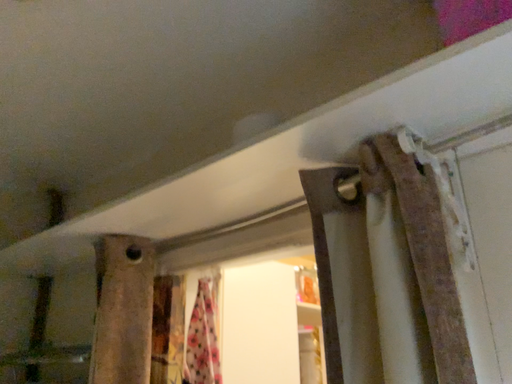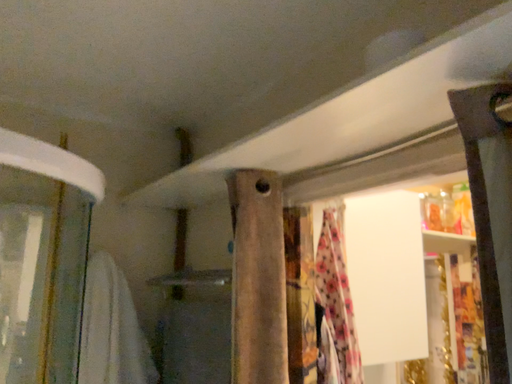
Question: Which way did the camera rotate in the video?

Choices:
 (A) rotated upward
 (B) rotated downward

Answer: (B)